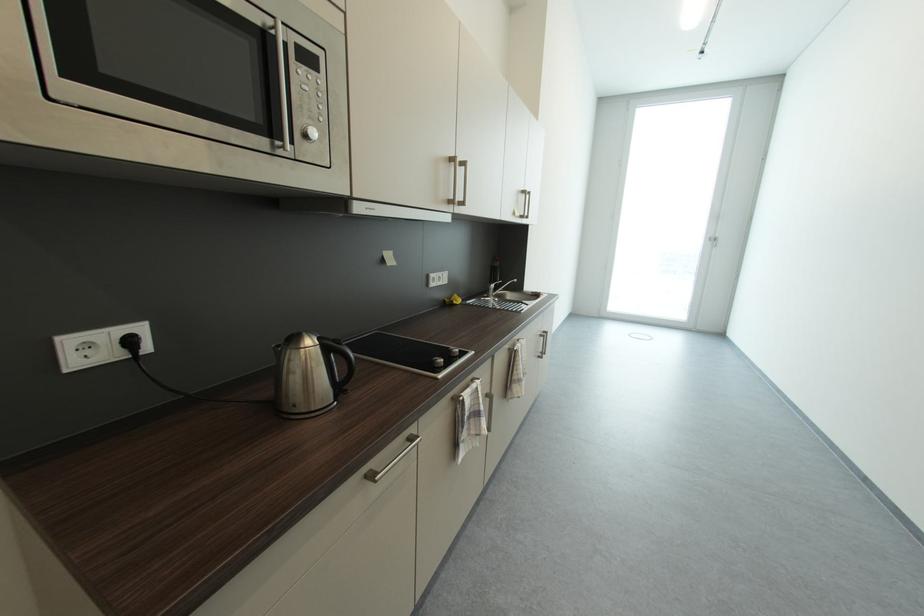
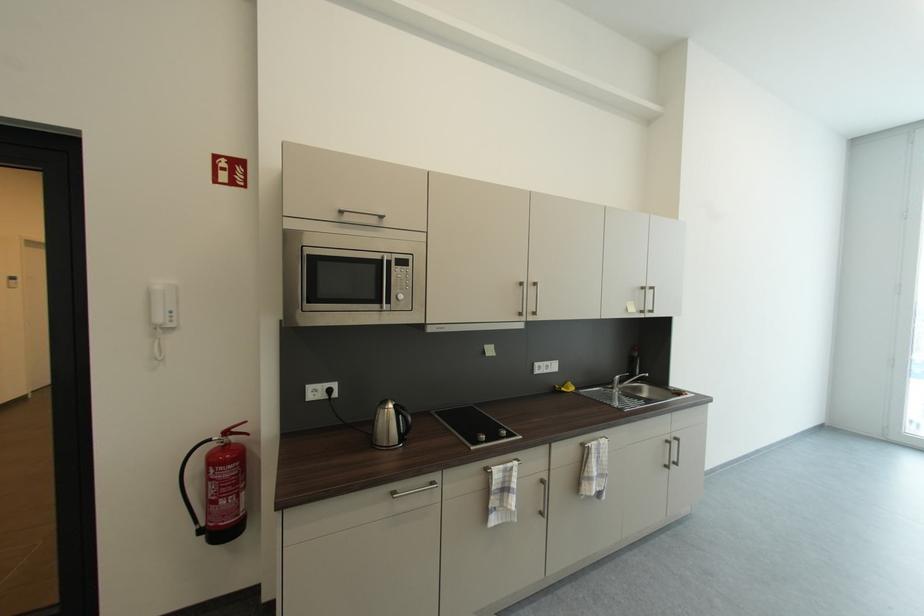
The point at (x=460, y=304) is marked in the first image. Where is the corresponding point in the second image?

(569, 391)